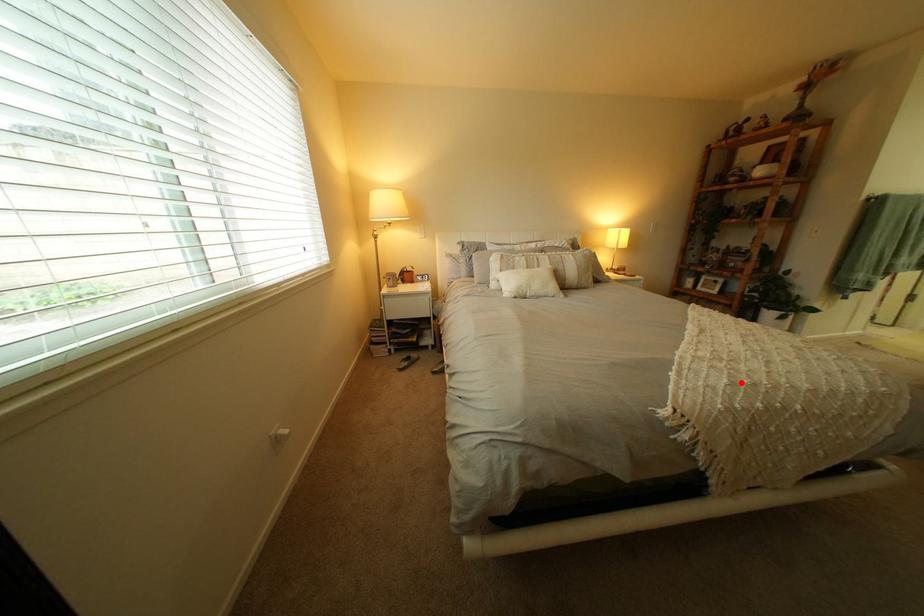
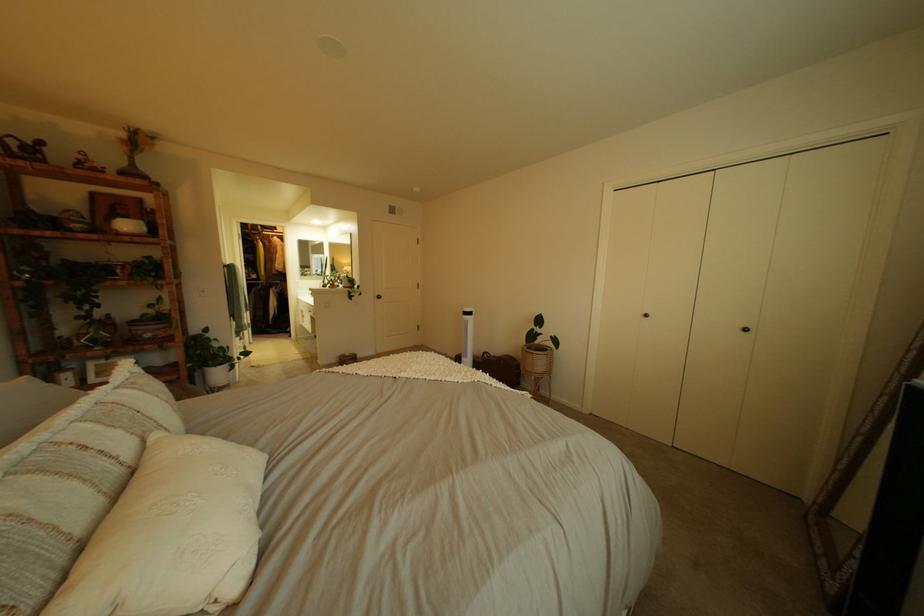
Question: A red point is marked in image1. In image2, is the corresponding 3D point closer to the camera or farther? Reply with the corresponding letter.

Choices:
 (A) The corresponding 3D point is closer.
 (B) The corresponding 3D point is farther.

Answer: (A)